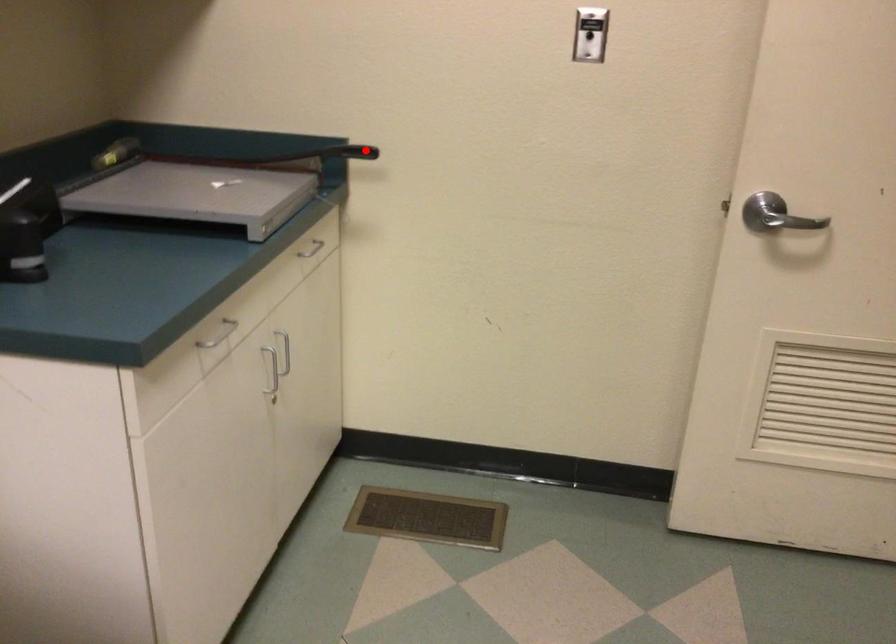
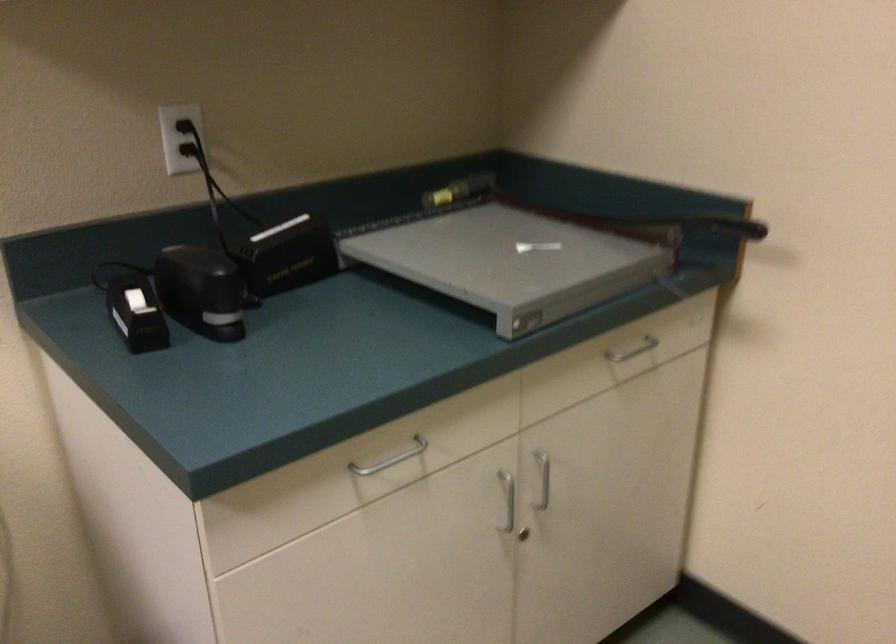
Where in the second image is the point corresponding to the highlighted location from the first image?

(742, 228)